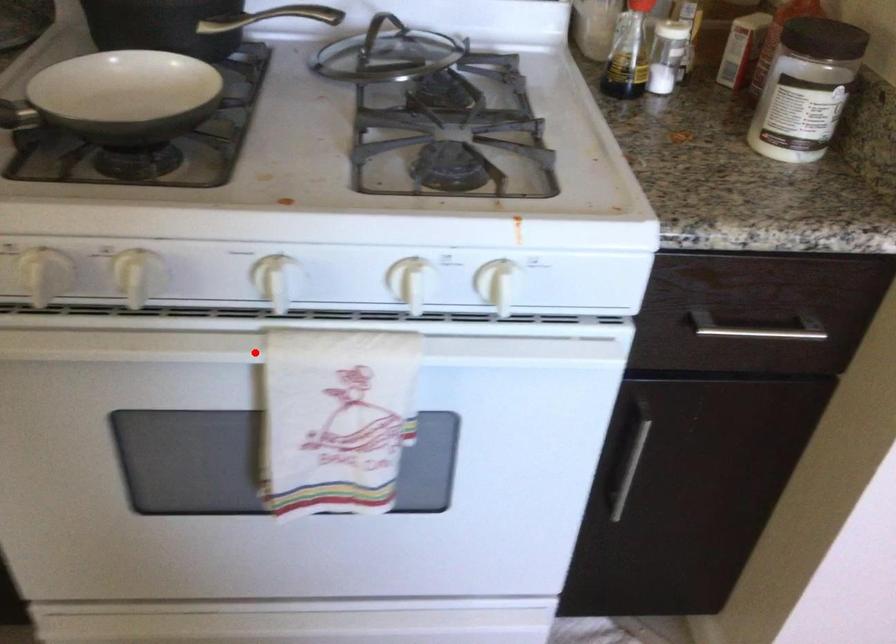
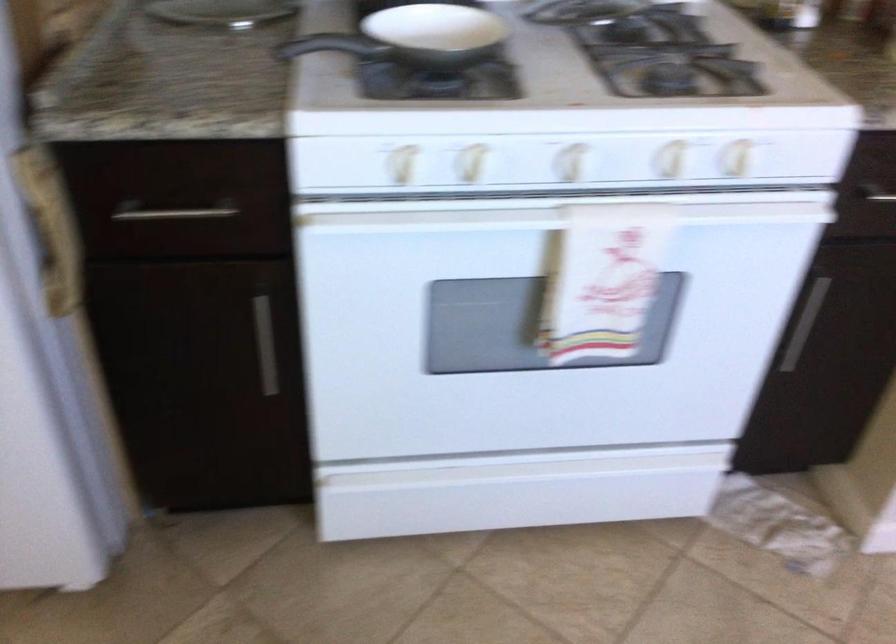
Find the pixel in the second image that matches the highlighted location in the first image.

(550, 218)